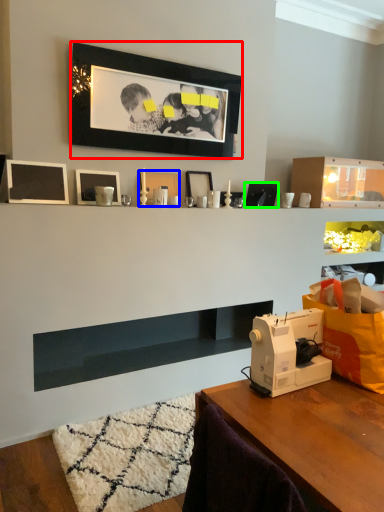
Question: Considering the real-world distances, which object is closest to picture frame (highlighted by a red box)? picture frame (highlighted by a blue box) or picture frame (highlighted by a green box).

Choices:
 (A) picture frame
 (B) picture frame

Answer: (A)